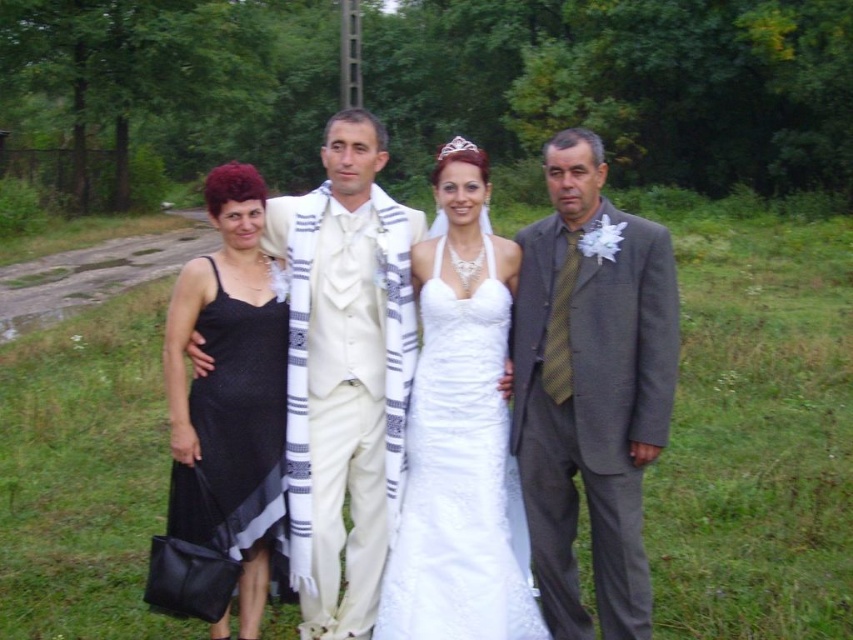
Does white satin dress at center lie behind white satin suit at center?

No, it is not.

Measure the distance between white satin dress at center and camera.

3.37 meters

The height and width of the screenshot is (640, 853). What are the coordinates of `white satin dress at center` in the screenshot? It's located at (590, 385).

Between white satin dress at center and black satin dress at left, which one is positioned higher?

black satin dress at left is above.

Which is behind, point (566, 276) or point (245, 312)?

Point (245, 312)

Is point (648, 224) behind point (274, 392)?

That is False.

Identify the location of white satin dress at center. The height and width of the screenshot is (640, 853). (x=590, y=385).

How far apart are white satin dress at center and silver metallic tiara at upper center?

white satin dress at center and silver metallic tiara at upper center are 3.42 meters apart.

Is white satin dress at center thinner than silver metallic tiara at upper center?

Yes, white satin dress at center is thinner than silver metallic tiara at upper center.

Image resolution: width=853 pixels, height=640 pixels. Describe the element at coordinates (590, 385) in the screenshot. I see `white satin dress at center` at that location.

Identify the location of white satin dress at center. (590, 385).